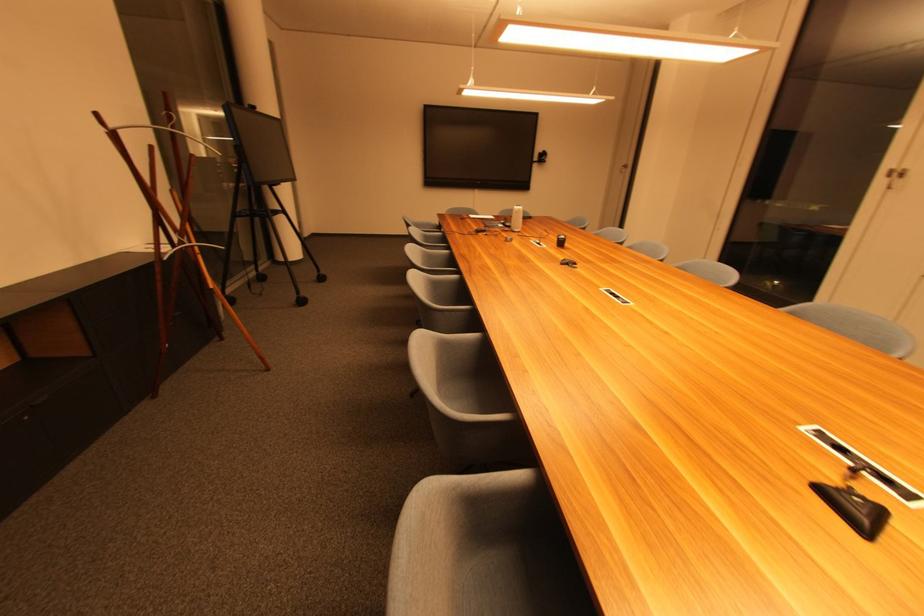
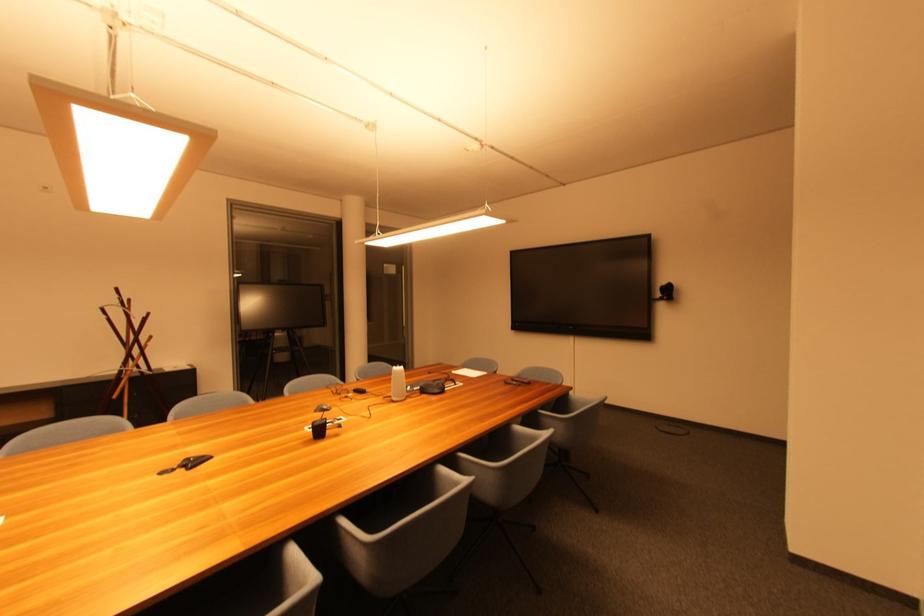
Locate, in the second image, the point that corresponds to (549,158) in the first image.

(673, 292)